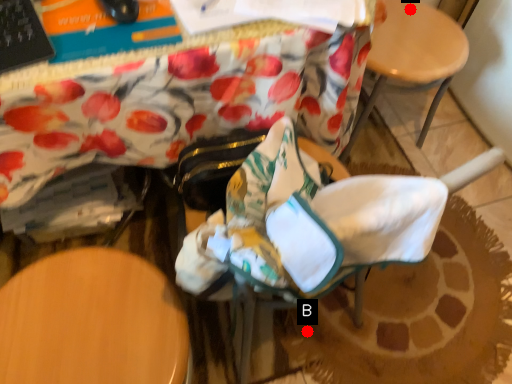
Question: Two points are circled on the image, labeled by A and B beside each circle. Which point is further to the camera?

Choices:
 (A) A is further
 (B) B is further

Answer: (A)